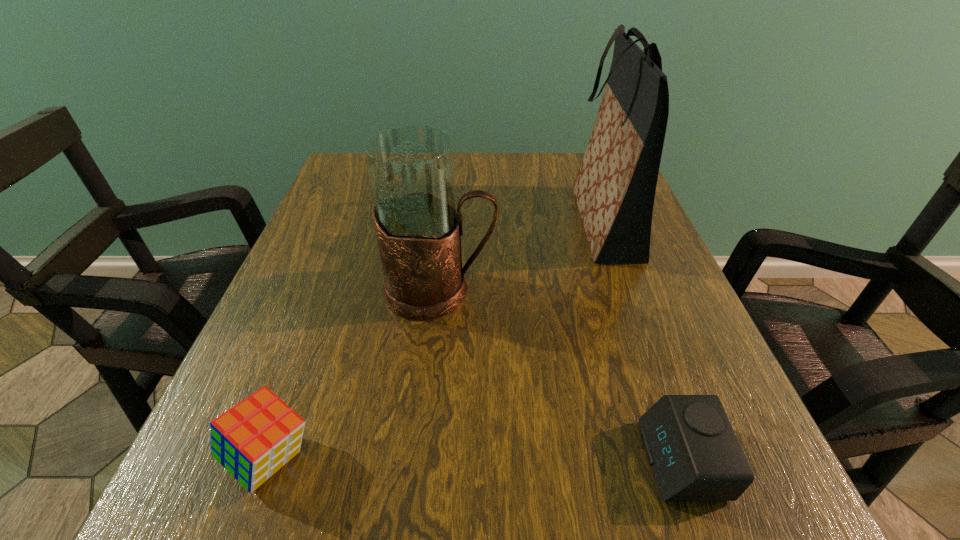
Where is `object situated at the near left corner`? The height and width of the screenshot is (540, 960). object situated at the near left corner is located at coordinates (254, 439).

Find the location of `object that is at the far right corner`. object that is at the far right corner is located at coordinates (614, 189).

At what (x,y) coordinates should I click in order to perform the action: click on object that is at the near right corner. Please return your answer as a coordinate pair (x, y). Looking at the image, I should click on (694, 454).

This screenshot has width=960, height=540. What are the coordinates of `vacant position at the left edge of the desktop` in the screenshot? It's located at (316, 347).

Image resolution: width=960 pixels, height=540 pixels. What are the coordinates of `vacant region at the right edge of the desktop` in the screenshot? It's located at (600, 292).

You are a GUI agent. You are given a task and a screenshot of the screen. Output one action in this format:
    pyautogui.click(x=<x>, y=<y>)
    Task: Click on the free space at the far left corner of the desktop
    
    Given the screenshot: What is the action you would take?
    pyautogui.click(x=358, y=179)

You are a GUI agent. You are given a task and a screenshot of the screen. Output one action in this format:
    pyautogui.click(x=<x>, y=<y>)
    Task: Click on the unoccupied area between the second tallest object and the alarm clock
    
    Given the screenshot: What is the action you would take?
    pyautogui.click(x=561, y=375)

The width and height of the screenshot is (960, 540). I want to click on empty space between the pitcher and the third tallest object, so click(355, 374).

You are a GUI agent. You are given a task and a screenshot of the screen. Output one action in this format:
    pyautogui.click(x=<x>, y=<y>)
    Task: Click on the unoccupied area between the second tallest object and the tallest object
    
    Given the screenshot: What is the action you would take?
    pyautogui.click(x=521, y=256)

Locate an element on the screen. This screenshot has height=540, width=960. free spot between the tallest object and the cube is located at coordinates (437, 340).